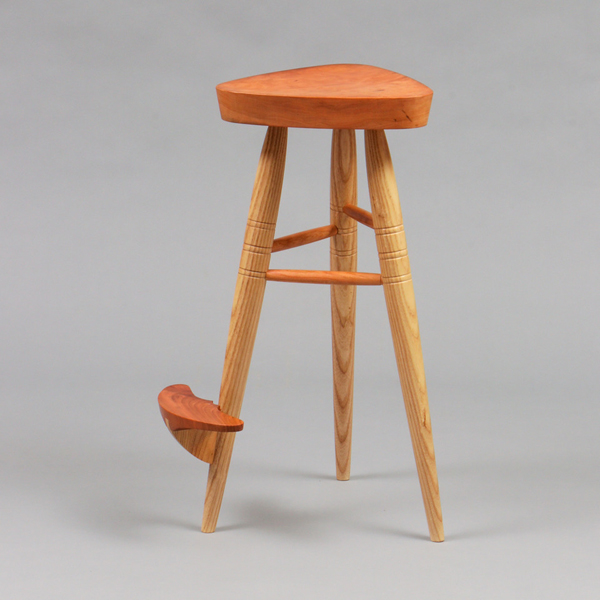
You are a GUI agent. You are given a task and a screenshot of the screen. Output one action in this format:
    pyautogui.click(x=<x>, y=<y>)
    Task: Click on the footrest
    The image size is (600, 600).
    Given the screenshot: What is the action you would take?
    pyautogui.click(x=321, y=276)